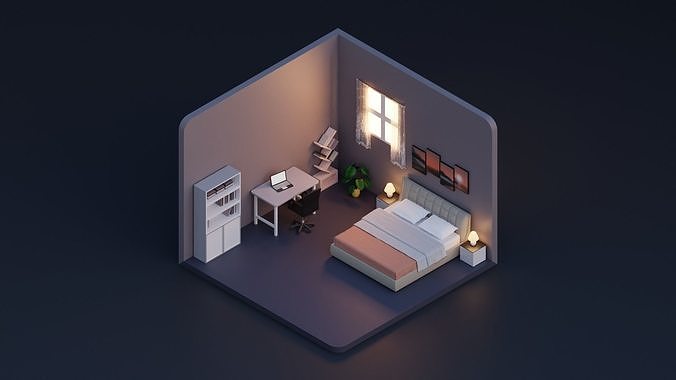
Where is `lamp`? Image resolution: width=676 pixels, height=380 pixels. lamp is located at coordinates (470, 232).